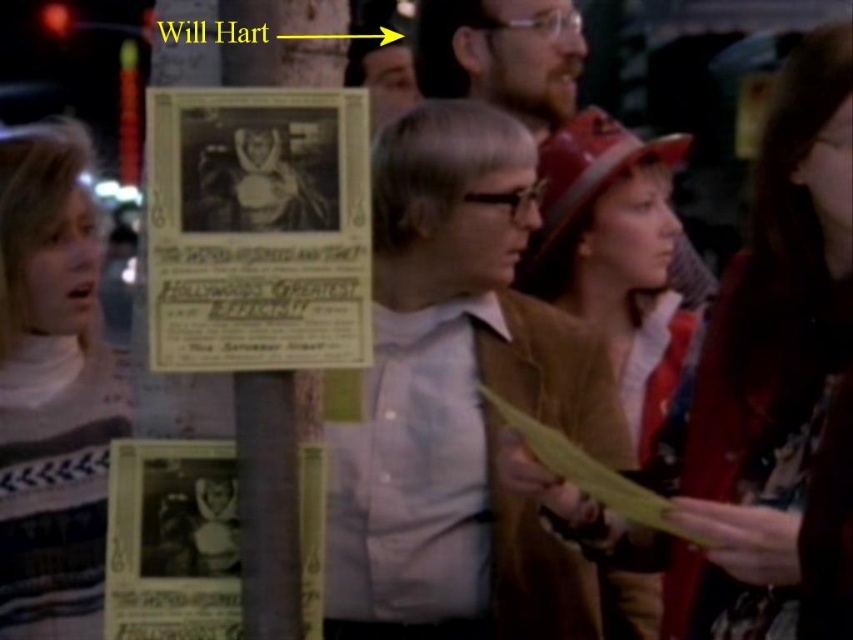
Can you confirm if yellow paper poster at center is taller than striped sweater at left?

No, yellow paper poster at center is not taller than striped sweater at left.

The image size is (853, 640). Describe the element at coordinates (257, 228) in the screenshot. I see `yellow paper poster at center` at that location.

Image resolution: width=853 pixels, height=640 pixels. What are the coordinates of `yellow paper poster at center` in the screenshot? It's located at (257, 228).

Does yellow paper poster at center have a greater width compared to brown suede hat at center?

In fact, yellow paper poster at center might be narrower than brown suede hat at center.

Can you confirm if yellow paper poster at center is smaller than brown suede hat at center?

Correct, yellow paper poster at center occupies less space than brown suede hat at center.

Is point (165, 227) less distant than point (566, 225)?

Yes, point (165, 227) is closer to viewer.

This screenshot has width=853, height=640. I want to click on yellow paper poster at center, so click(257, 228).

Between yellow paper poster at center and bearded man with glasses at upper center, which one has less height?

With less height is yellow paper poster at center.

The image size is (853, 640). What are the coordinates of `yellow paper poster at center` in the screenshot? It's located at (257, 228).